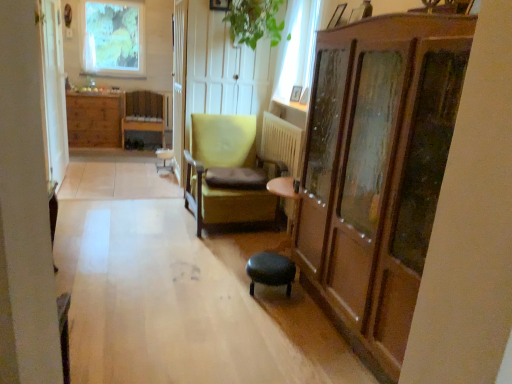
Question: From a real-world perspective, is metallic silver picture frame at upper right, the 1th picture frame in the front-to-back sequence, located higher than matte yellow armchair at center, the 2th chair viewed from the top?

Choices:
 (A) yes
 (B) no

Answer: (A)

Question: From the image's perspective, would you say metallic silver picture frame at upper right, which appears as the third picture frame when viewed from the back, is positioned over matte yellow armchair at center, which ranks as the second chair in left-to-right order?

Choices:
 (A) yes
 (B) no

Answer: (A)

Question: Considering the relative positions of metallic silver picture frame at upper right, which is counted as the 3th picture frame, starting from the left, and matte yellow armchair at center, which ranks as the second chair in left-to-right order, in the image provided, is metallic silver picture frame at upper right, which is counted as the 3th picture frame, starting from the left, to the left of matte yellow armchair at center, which ranks as the second chair in left-to-right order, from the viewer's perspective?

Choices:
 (A) yes
 (B) no

Answer: (B)

Question: Does metallic silver picture frame at upper right, the 2th picture frame viewed from the top, come in front of matte yellow armchair at center, the first chair positioned from the right?

Choices:
 (A) yes
 (B) no

Answer: (A)

Question: Is metallic silver picture frame at upper right, the 2th picture frame positioned from the bottom, wider than matte yellow armchair at center, which ranks as the second chair in left-to-right order?

Choices:
 (A) yes
 (B) no

Answer: (B)

Question: Is wooden picture frame at upper right, placed as the first picture frame when sorted from bottom to top, spatially inside metallic silver picture frame at upper right, which is counted as the 3th picture frame, starting from the left, or outside of it?

Choices:
 (A) outside
 (B) inside

Answer: (A)

Question: From the image's perspective, is wooden picture frame at upper right, the second picture frame positioned from the right, located above or below metallic silver picture frame at upper right, the 2th picture frame positioned from the bottom?

Choices:
 (A) above
 (B) below

Answer: (B)

Question: Visually, is wooden picture frame at upper right, which is the 3th picture frame in top-to-bottom order, positioned to the left or to the right of metallic silver picture frame at upper right, which is counted as the 3th picture frame, starting from the left?

Choices:
 (A) left
 (B) right

Answer: (A)

Question: Considering the positions of wooden picture frame at upper right, positioned as the second picture frame in left-to-right order, and metallic silver picture frame at upper right, the 1th picture frame in the front-to-back sequence, in the image, is wooden picture frame at upper right, positioned as the second picture frame in left-to-right order, taller or shorter than metallic silver picture frame at upper right, the 1th picture frame in the front-to-back sequence,?

Choices:
 (A) tall
 (B) short

Answer: (A)

Question: Considering the positions of green fabric bar stool at center and matte yellow armchair at center, which is counted as the 1th chair, starting from the front, in the image, is green fabric bar stool at center wider or thinner than matte yellow armchair at center, which is counted as the 1th chair, starting from the front,?

Choices:
 (A) wide
 (B) thin

Answer: (B)

Question: From a real-world perspective, is green fabric bar stool at center above or below matte yellow armchair at center, which is counted as the 1th chair, starting from the front?

Choices:
 (A) below
 (B) above

Answer: (A)

Question: In terms of size, does green fabric bar stool at center appear bigger or smaller than matte yellow armchair at center, positioned as the 1th chair in bottom-to-top order?

Choices:
 (A) big
 (B) small

Answer: (B)

Question: From the image's perspective, is green fabric bar stool at center located above or below matte yellow armchair at center, which is counted as the second chair, starting from the back?

Choices:
 (A) below
 (B) above

Answer: (B)

Question: Is green fabric bar stool at center taller or shorter than metallic silver picture frame at upper right, the 2th picture frame positioned from the bottom?

Choices:
 (A) short
 (B) tall

Answer: (B)

Question: From a real-world perspective, is green fabric bar stool at center positioned above or below metallic silver picture frame at upper right, marked as the 1th picture frame in a right-to-left arrangement?

Choices:
 (A) below
 (B) above

Answer: (A)